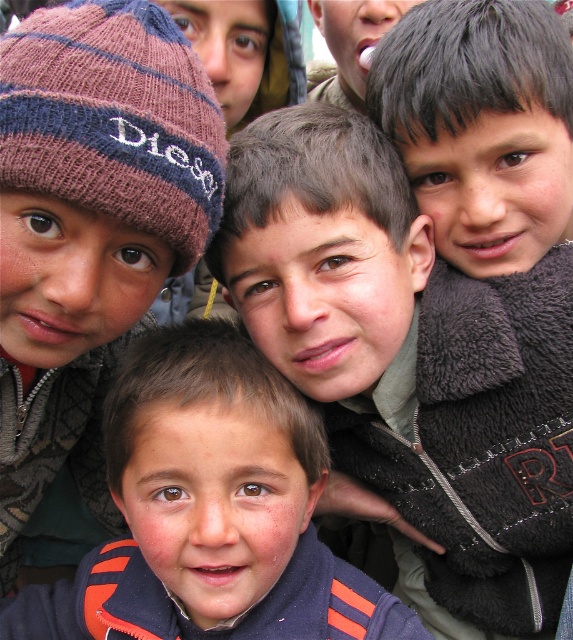
You are a photographer trying to capture a closeup of the knitted woolen beanie at upper left without including the dark blue fleece jacket at center in the frame. Given their sizes, can you do this?

The dark blue fleece jacket at center is bigger than the knitted woolen beanie at upper left, so it might be challenging to frame the beanie without including the jacket if they are positioned closely together in the scene.